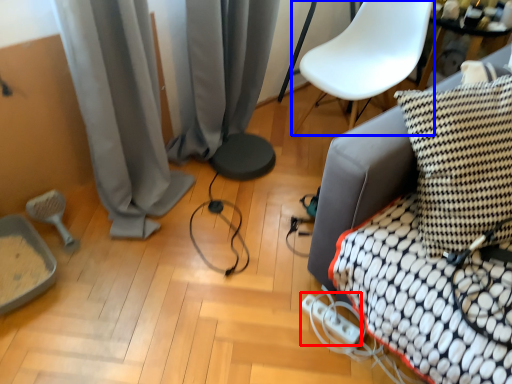
Question: Among these objects, which one is farthest to the camera, extension cord (highlighted by a red box) or armchair (highlighted by a blue box)?

Choices:
 (A) extension cord
 (B) armchair

Answer: (B)